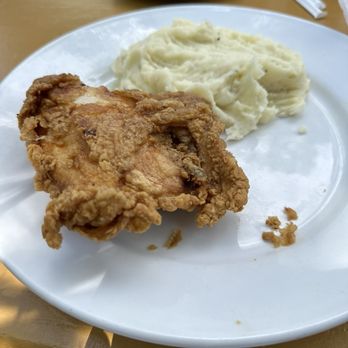
What are the coordinates of `table` in the screenshot? It's located at (30, 20).